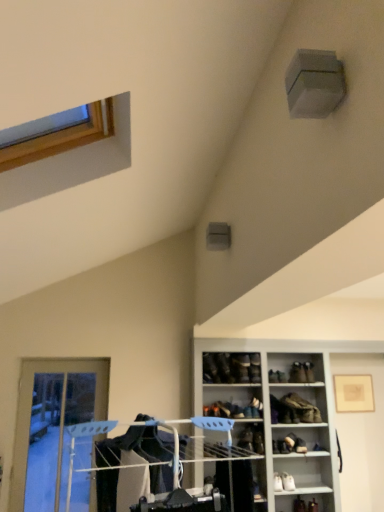
Question: Is matte black shoe at upper center, which is the 1th shoe in top-to-bottom order, facing away from black leather shoe at center, which is the 2th shoe in top-to-bottom order?

Choices:
 (A) yes
 (B) no

Answer: (B)

Question: Is matte black shoe at upper center, which is counted as the third shoe, starting from the right, bigger than black leather shoe at center, which is the 2th shoe in top-to-bottom order?

Choices:
 (A) yes
 (B) no

Answer: (A)

Question: From a real-world perspective, is matte black shoe at upper center, which is counted as the third shoe, starting from the right, over black leather shoe at center, placed as the 3th shoe when sorted from bottom to top?

Choices:
 (A) no
 (B) yes

Answer: (B)

Question: Is matte black shoe at upper center, which is counted as the third shoe, starting from the right, thinner than black leather shoe at center, placed as the 3th shoe when sorted from bottom to top?

Choices:
 (A) no
 (B) yes

Answer: (A)

Question: From a real-world perspective, is matte black shoe at upper center, the 4th shoe ordered from the bottom, below black leather shoe at center, the 4th shoe viewed from the right?

Choices:
 (A) no
 (B) yes

Answer: (A)

Question: In terms of height, does leather boot at center, the 1th footwear when ordered from top to bottom, look taller or shorter compared to matte black shoe at upper center, which ranks as the second shoe in left-to-right order?

Choices:
 (A) tall
 (B) short

Answer: (B)

Question: Considering the positions of leather boot at center, the 1th footwear when ordered from top to bottom, and matte black shoe at upper center, which is counted as the third shoe, starting from the right, in the image, is leather boot at center, the 1th footwear when ordered from top to bottom, bigger or smaller than matte black shoe at upper center, which is counted as the third shoe, starting from the right,?

Choices:
 (A) small
 (B) big

Answer: (B)

Question: Considering the positions of leather boot at center, the third footwear ordered from the bottom, and matte black shoe at upper center, the 4th shoe ordered from the bottom, in the image, is leather boot at center, the third footwear ordered from the bottom, wider or thinner than matte black shoe at upper center, the 4th shoe ordered from the bottom,?

Choices:
 (A) thin
 (B) wide

Answer: (B)

Question: Considering the relative positions of leather boot at center, the 1th footwear when ordered from top to bottom, and matte black shoe at upper center, which ranks as the second shoe in left-to-right order, in the image provided, is leather boot at center, the 1th footwear when ordered from top to bottom, to the left or to the right of matte black shoe at upper center, which ranks as the second shoe in left-to-right order,?

Choices:
 (A) right
 (B) left

Answer: (A)

Question: Is white glossy cabinet at lower right situated inside leather boot at lower right, which ranks as the second footwear in bottom-to-top order, or outside?

Choices:
 (A) outside
 (B) inside

Answer: (A)

Question: From their relative heights in the image, would you say white glossy cabinet at lower right is taller or shorter than leather boot at lower right, which appears as the 2th footwear when viewed from the top?

Choices:
 (A) tall
 (B) short

Answer: (A)

Question: Would you say white glossy cabinet at lower right is to the left or to the right of leather boot at lower right, which ranks as the second footwear in bottom-to-top order, in the picture?

Choices:
 (A) right
 (B) left

Answer: (A)

Question: Is white glossy cabinet at lower right in front of or behind leather boot at lower right, which ranks as the second footwear in bottom-to-top order, in the image?

Choices:
 (A) front
 (B) behind

Answer: (A)

Question: From a real-world perspective, relative to black leather shoe at center, which is the 2th shoe in top-to-bottom order, is matte gold picture frame at upper right vertically above or below?

Choices:
 (A) above
 (B) below

Answer: (B)

Question: Would you say matte gold picture frame at upper right is to the left or to the right of black leather shoe at center, which is the 2th shoe in top-to-bottom order, in the picture?

Choices:
 (A) left
 (B) right

Answer: (B)